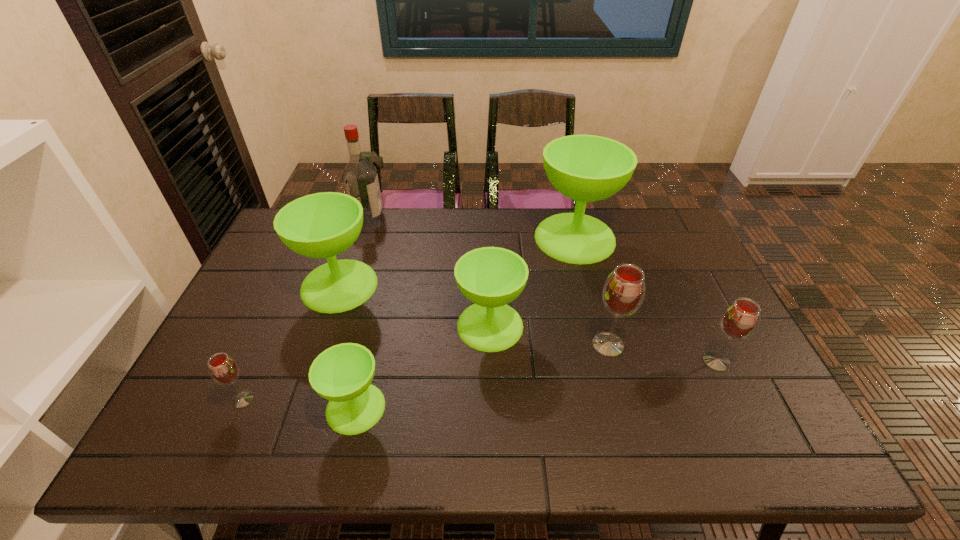
Find the location of a particular element. liquor at the far edge is located at coordinates (360, 178).

Where is `wineglass that is at the far edge`? Image resolution: width=960 pixels, height=540 pixels. wineglass that is at the far edge is located at coordinates coord(586,168).

The image size is (960, 540). In order to click on object that is at the near edge in this screenshot , I will do click(x=342, y=374).

The height and width of the screenshot is (540, 960). Find the location of `object situated at the right edge`. object situated at the right edge is located at coordinates (740, 319).

The width and height of the screenshot is (960, 540). In the image, there is a desktop. Find the location of `vacant region at the far edge`. vacant region at the far edge is located at coordinates (515, 217).

At what (x,y) coordinates should I click in order to perform the action: click on vacant space at the near edge of the desktop. Please return your answer as a coordinate pair (x, y). Looking at the image, I should click on (378, 460).

Image resolution: width=960 pixels, height=540 pixels. I want to click on vacant space at the left edge, so click(x=283, y=275).

Image resolution: width=960 pixels, height=540 pixels. I want to click on vacant space at the near right corner of the desktop, so click(x=723, y=436).

You are a GUI agent. You are given a task and a screenshot of the screen. Output one action in this format:
    pyautogui.click(x=<x>, y=<y>)
    Task: Click on the empty location between the nearest green wineglass and the biggest red wineglass
    
    Given the screenshot: What is the action you would take?
    pyautogui.click(x=482, y=376)

Locate an element on the screen. free spot between the biggest red wineglass and the nearest green wineglass is located at coordinates pyautogui.click(x=482, y=376).